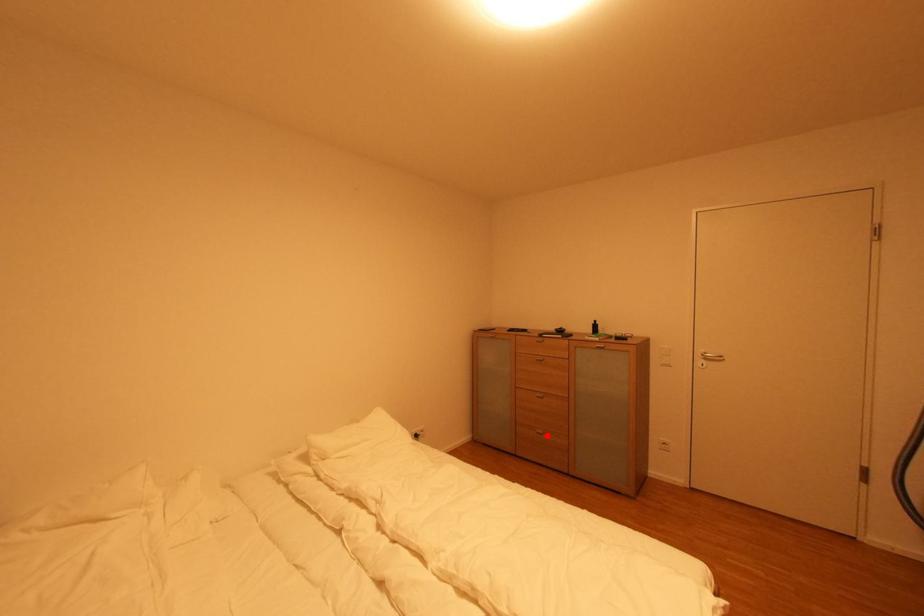
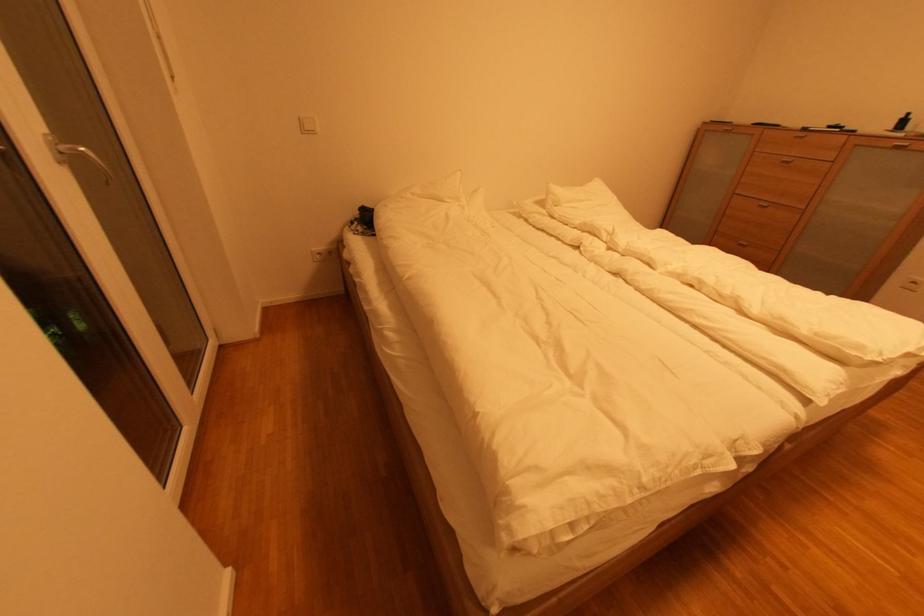
Where in the second image is the point corresponding to the highlighted location from the first image?

(749, 246)